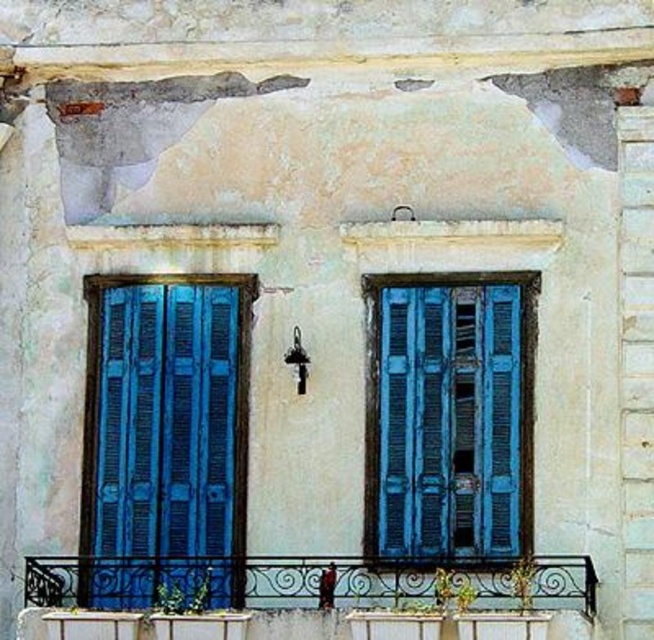
Question: Observing the image, what is the correct spatial positioning of blue wooden window at center in reference to wrought iron balcony at lower center?

Choices:
 (A) right
 (B) left

Answer: (A)

Question: Which point is closer to the camera?

Choices:
 (A) (73, 580)
 (B) (366, 412)

Answer: (B)

Question: Which of the following is the farthest from the observer?

Choices:
 (A) (432, 573)
 (B) (390, 330)

Answer: (B)

Question: Where is blue wooden shutters at left located in relation to wrought iron balcony at lower center in the image?

Choices:
 (A) below
 (B) above

Answer: (B)

Question: Can you confirm if blue wooden shutters at left is positioned above blue wooden window at center?

Choices:
 (A) no
 (B) yes

Answer: (A)

Question: Which point is farther to the camera?

Choices:
 (A) (371, 509)
 (B) (222, 560)

Answer: (B)